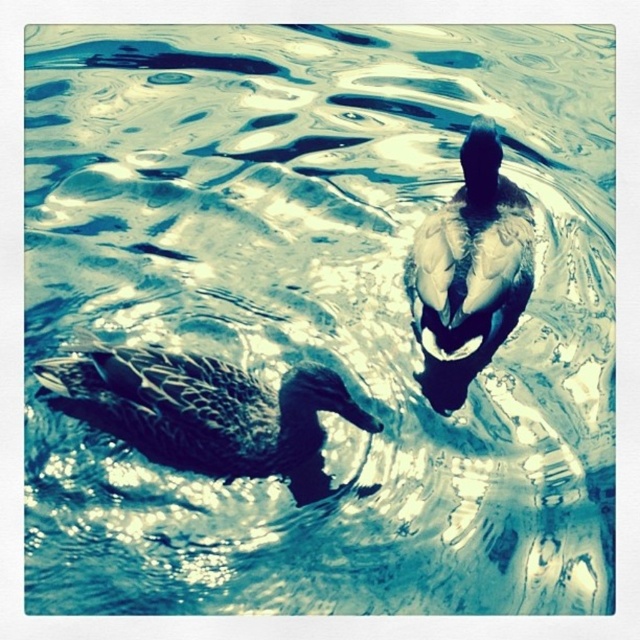
In the scene shown: You are a photographer trying to capture the ducks in the scene. You want to position your camera so that the dark brown feathers duck at lower left and the dark brown feathers at upper center are both in frame. Based on their positions, which duck should you focus on first to ensure both are visible?

The dark brown feathers duck at lower left is to the left of dark brown feathers at upper center, so you should focus on the dark brown feathers duck at lower left first to ensure both are visible in the frame.

You are a birdwatcher observing the scene. You notice two objects labeled dark brown feathers duck at lower left and dark brown feathers at upper center. Which one is positioned lower in the image?

The dark brown feathers duck at lower left is positioned lower in the image than the dark brown feathers at upper center.